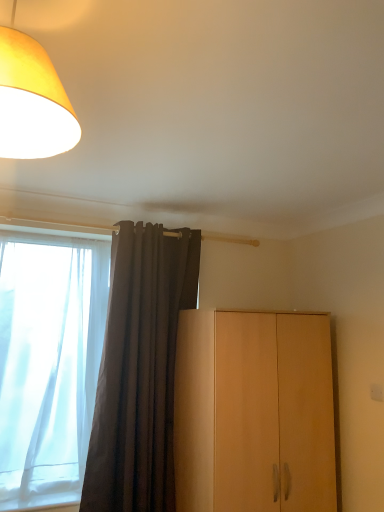
Question: Which is correct: yellow fabric lampshade at upper left is inside light wood cabinet at right, or outside of it?

Choices:
 (A) outside
 (B) inside

Answer: (A)

Question: From a real-world perspective, is yellow fabric lampshade at upper left positioned above or below light wood cabinet at right?

Choices:
 (A) above
 (B) below

Answer: (A)

Question: Which object is the closest to the white sheer curtain at left?

Choices:
 (A) dark gray fabric curtain at center
 (B) light wood cabinet at right
 (C) yellow fabric lampshade at upper left

Answer: (A)

Question: Based on their relative distances, which object is farther from the white sheer curtain at left?

Choices:
 (A) light wood cabinet at right
 (B) yellow fabric lampshade at upper left
 (C) dark gray fabric curtain at center

Answer: (B)